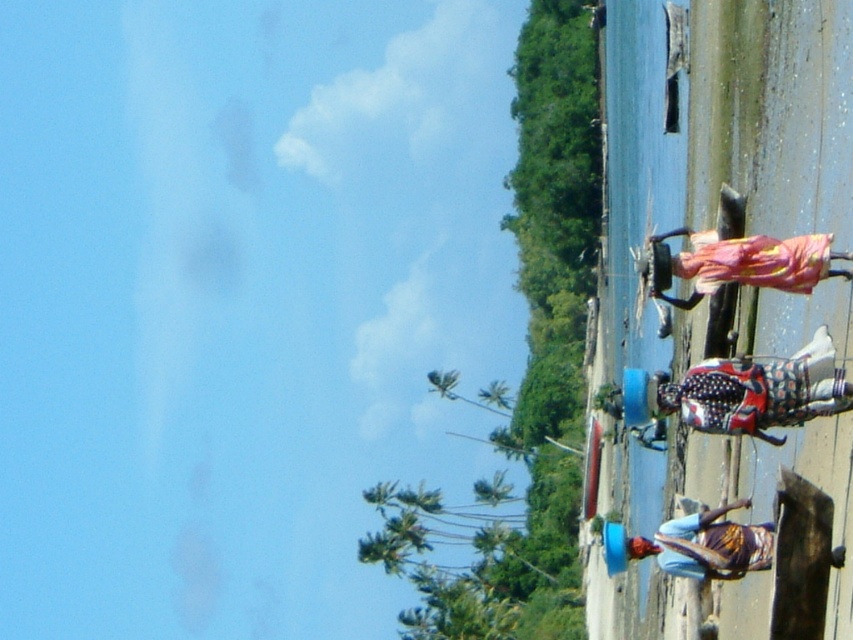
Question: Can you confirm if polka dot fabric at center is positioned above multicolored fabric at lower center?

Choices:
 (A) no
 (B) yes

Answer: (B)

Question: Which point is closer to the camera?

Choices:
 (A) (724, 561)
 (B) (819, 388)

Answer: (B)

Question: Among these objects, which one is farthest from the camera?

Choices:
 (A) polka dot fabric at center
 (B) multicolored fabric at lower center

Answer: (B)

Question: Considering the relative positions of polka dot fabric at center and multicolored fabric at lower center in the image provided, where is polka dot fabric at center located with respect to multicolored fabric at lower center?

Choices:
 (A) below
 (B) above

Answer: (B)

Question: Does polka dot fabric at center have a smaller size compared to multicolored fabric at lower center?

Choices:
 (A) no
 (B) yes

Answer: (B)